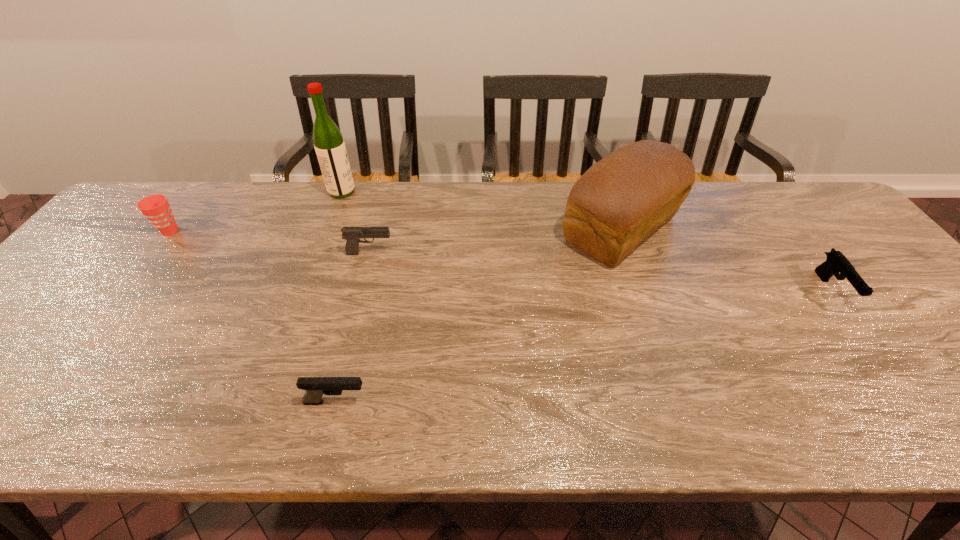
The image size is (960, 540). In order to click on vacant region that satisfies the following two spatial constraints: 1. on the label of the bread; 2. on the left side of the liquor in this screenshot , I will do `click(328, 229)`.

Find the location of a particular element. vacant space that satisfies the following two spatial constraints: 1. on the front side of the bread; 2. aim along the barrel of the farthest pistol is located at coordinates (630, 253).